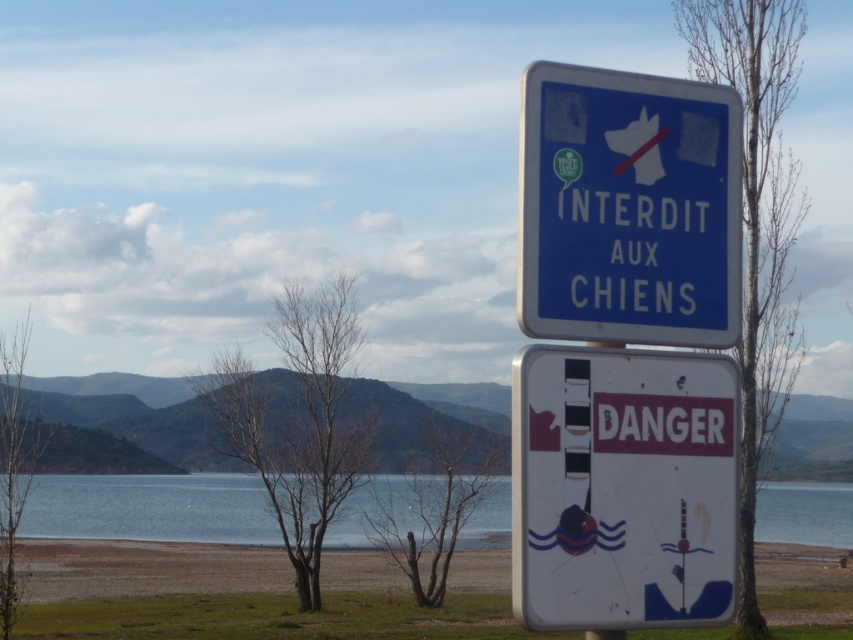
You are a hiker who wants to know which sign is wider. You see the white plastic danger sign at center and the blue plastic sign at center. Which one is wider?

The blue plastic sign at center is wider than the white plastic danger sign at center.

You are standing at the signpost near the water and want to place a small floating marker on the blue water at lower center. Can you place it directly below the white plastic danger sign at center without it being blocked by the sign?

The white plastic danger sign at center is positioned over the blue water at lower center, so placing the floating marker directly below the sign would be blocked by the sign itself. Choose another location for the marker.